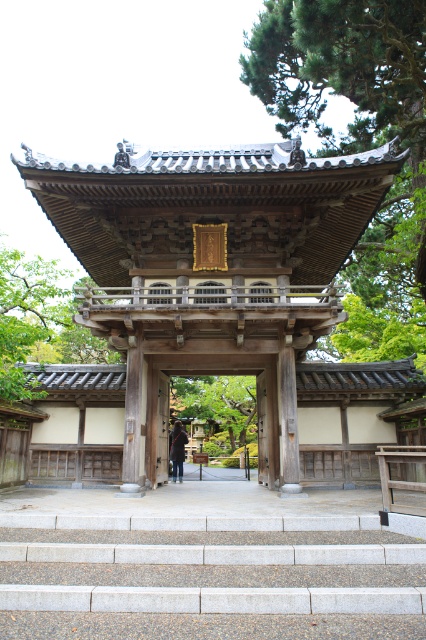
Question: Estimate the real-world distances between objects in this image. Which object is closer to the wooden gate at center?

Choices:
 (A) dark brown leather jacket at center
 (B) green leafy tree at center
 (C) gray concrete stairs at lower center
 (D) green leafy tree at upper center

Answer: (D)

Question: Can you confirm if gray concrete stairs at lower center is smaller than green leafy tree at center?

Choices:
 (A) no
 (B) yes

Answer: (A)

Question: Which point appears closest to the camera in this image?

Choices:
 (A) tap(268, 321)
 (B) tap(245, 48)
 (C) tap(207, 403)

Answer: (A)

Question: Which of these objects is positioned farthest from the dark brown leather jacket at center?

Choices:
 (A) green leafy tree at center
 (B) gray concrete stairs at lower center
 (C) green leafy tree at upper center
 (D) wooden gate at center

Answer: (A)

Question: Is wooden gate at center further to the viewer compared to dark brown leather jacket at center?

Choices:
 (A) no
 (B) yes

Answer: (A)

Question: In this image, where is green leafy tree at center located relative to dark brown leather jacket at center?

Choices:
 (A) above
 (B) below

Answer: (B)